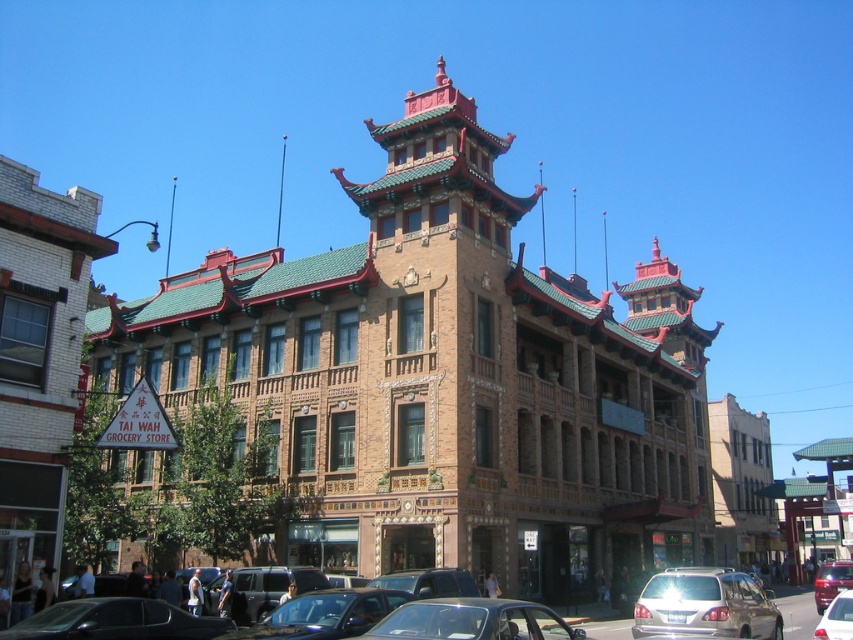
You are a delivery driver who needs to park your vehicle between the shiny black sedan at lower left and the shiny black car at lower center. Which vehicle should you position your car closer to in order to maintain proper parking distance?

You should position your car closer to the shiny black car at lower center because the shiny black sedan at lower left is shorter in height, which might indicate it takes up less space, allowing more room near the taller shiny black car at lower center.

You are standing at the entrance of the multi story building with East Asian architectural style. You see a point located at coordinate (115, 621). What object is this point located on?

The point at coordinate (115, 621) is located on the shiny black sedan at lower left.